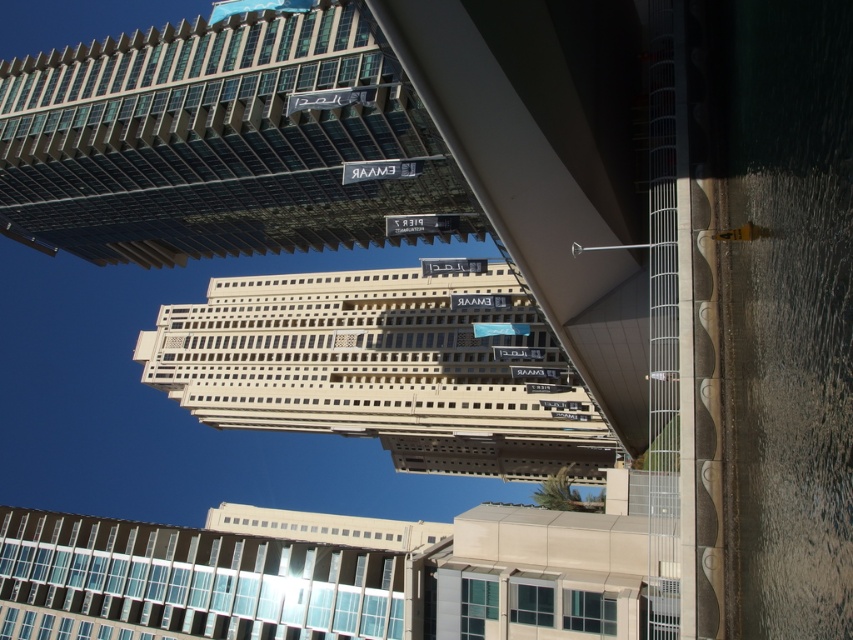
Question: Does glassy steel skyscraper at upper left lie behind white concrete building at center?

Choices:
 (A) yes
 (B) no

Answer: (B)

Question: Among these points, which one is nearest to the camera?

Choices:
 (A) (416, 99)
 (B) (419, 448)

Answer: (A)

Question: Does glassy steel skyscraper at upper left have a smaller size compared to white concrete building at center?

Choices:
 (A) no
 (B) yes

Answer: (B)

Question: Can you confirm if glassy steel skyscraper at upper left is bigger than white concrete building at center?

Choices:
 (A) yes
 (B) no

Answer: (B)

Question: Among these objects, which one is nearest to the camera?

Choices:
 (A) white concrete building at center
 (B) glassy steel skyscraper at upper left

Answer: (B)

Question: Which of the following is the farthest from the observer?

Choices:
 (A) (276, 195)
 (B) (286, 410)

Answer: (B)